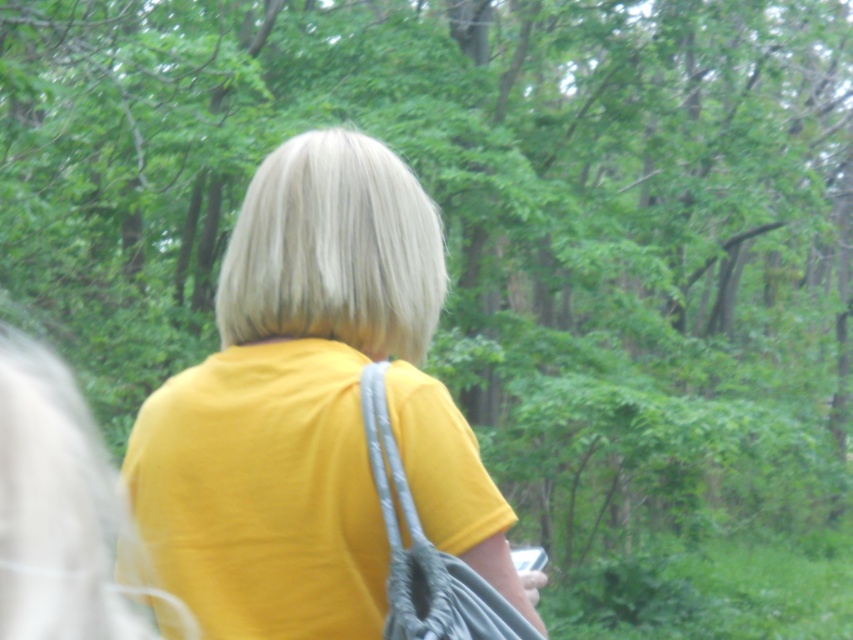
Who is positioned more to the left, matte yellow shirt at center or gray fabric strap at center?

From the viewer's perspective, matte yellow shirt at center appears more on the left side.

Where is `matte yellow shirt at center`? The height and width of the screenshot is (640, 853). matte yellow shirt at center is located at coordinates (312, 410).